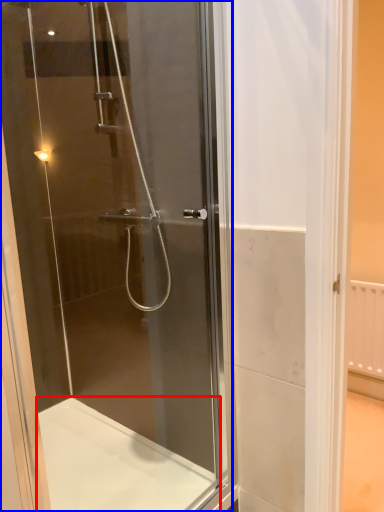
Question: Which object appears farthest to the camera in this image, bath (highlighted by a red box) or screen door (highlighted by a blue box)?

Choices:
 (A) bath
 (B) screen door

Answer: (A)